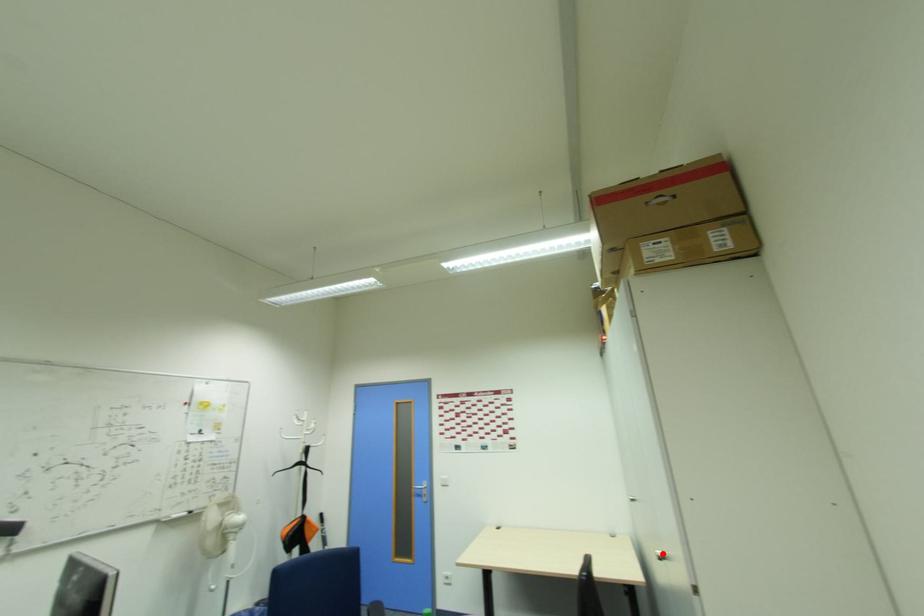
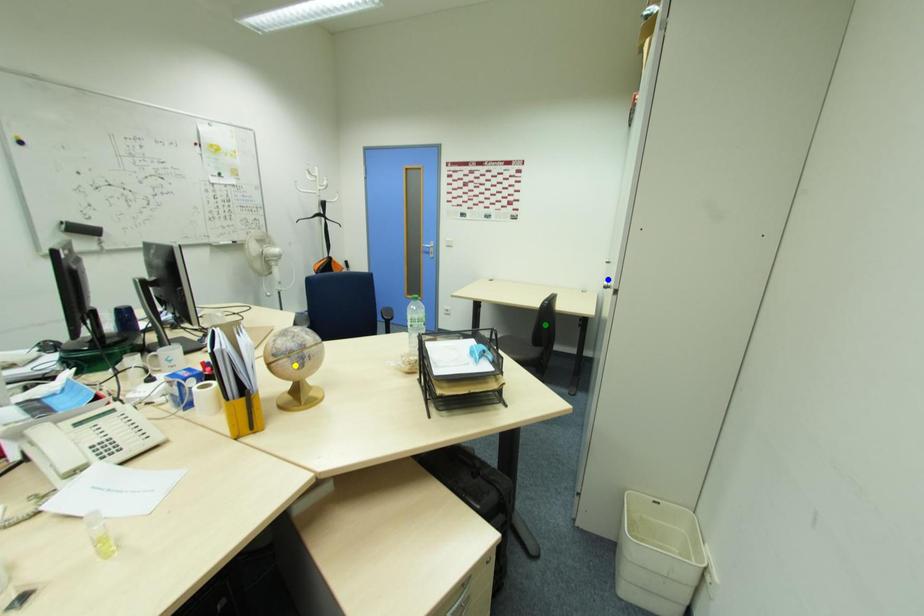
Question: I am providing you with two images of the same scene from different viewpoints. A red point is marked on the first image. You are given multiple points on the second image. Which point in image 2 is actually the same real-world point as the red point in image 1?

Choices:
 (A) blue point
 (B) green point
 (C) yellow point

Answer: (A)